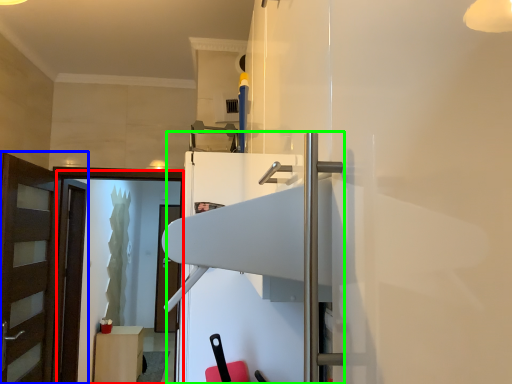
Question: Which is farther away from screen door (highlighted by a red box)? door (highlighted by a blue box) or fridge (highlighted by a green box)?

Choices:
 (A) door
 (B) fridge

Answer: (B)